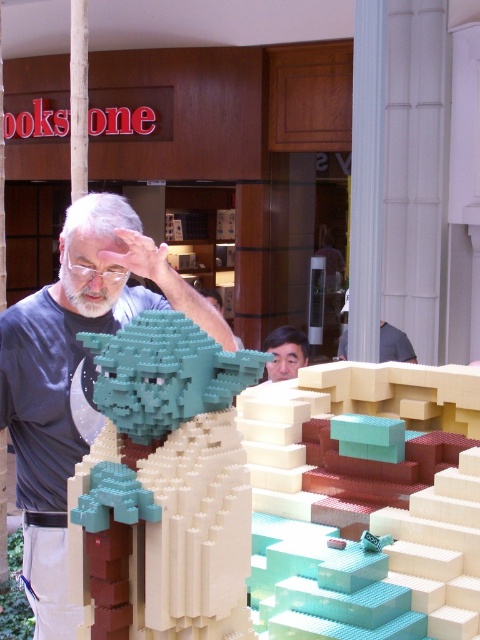
You are a photographer trying to capture a clear shot of the smooth skin face at center. Since the matte gray shirt at center might block the view, can you determine which object is closer to the camera based on their positions?

The smooth skin face at center is closer to the camera than the matte gray shirt at center because the matte gray shirt at center is positioned below the smooth skin face at center.

You are a photographer standing at the origin point of the coordinate system. You need to take a photo of the teal matte lego figure at center. What are the coordinates where you should aim your camera?

The coordinates to aim your camera are at point (166, 484) where the teal matte lego figure at center is located.

You are a LEGO designer who needs to ensure that the teal matte lego figure at center and the smooth skin face at center fit on a display stand that can only accommodate the larger of the two. Which object should you place on the stand?

The teal matte lego figure at center should be placed on the display stand because it is larger in size than the smooth skin face at center, making it the better fit for the stand designed to hold the larger object.